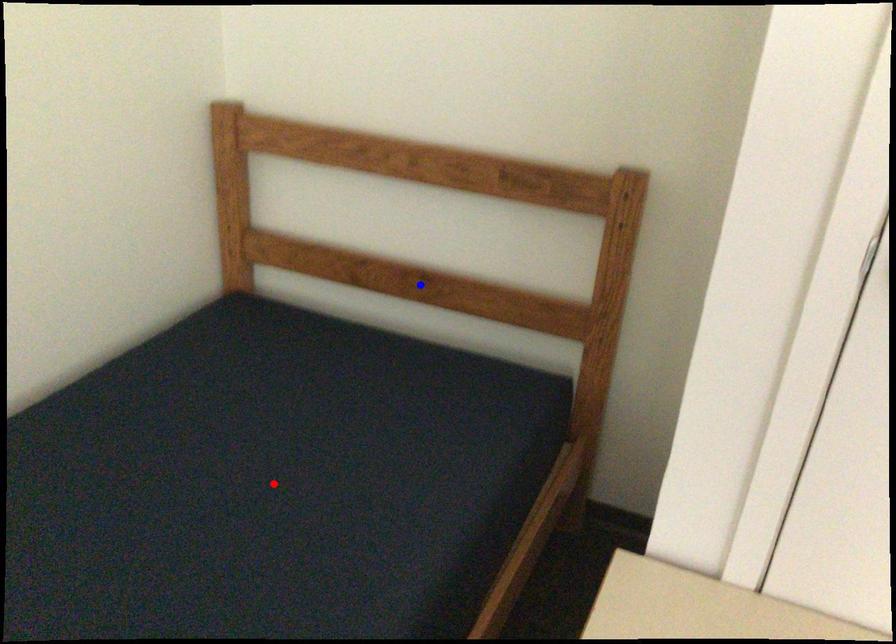
Question: Which of the two points in the image is closer to the camera?

Choices:
 (A) Blue point is closer.
 (B) Red point is closer.

Answer: (B)